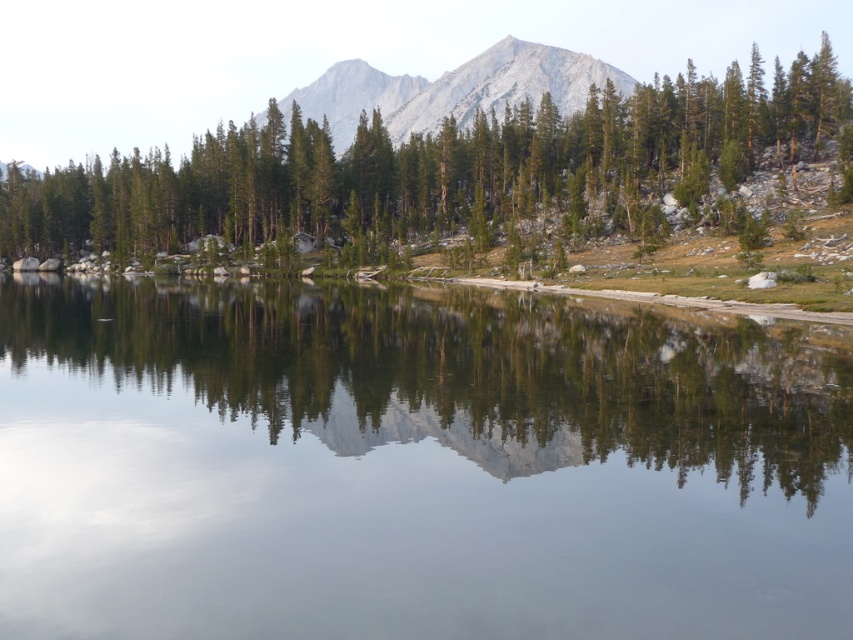
Question: Which object is the farthest from the smooth reflective water at center?

Choices:
 (A) gray rocky mountain at center
 (B) green matte tree at center

Answer: (A)

Question: Which point is closer to the camera taking this photo?

Choices:
 (A) (631, 614)
 (B) (279, 209)

Answer: (A)

Question: Does smooth reflective water at center come in front of gray rocky mountain at center?

Choices:
 (A) no
 (B) yes

Answer: (B)

Question: Does smooth reflective water at center lie behind gray rocky mountain at center?

Choices:
 (A) no
 (B) yes

Answer: (A)

Question: Which point is farther to the camera?

Choices:
 (A) green matte tree at center
 (B) smooth reflective water at center
 (C) gray rocky mountain at center

Answer: (C)

Question: Does smooth reflective water at center lie in front of gray rocky mountain at center?

Choices:
 (A) yes
 (B) no

Answer: (A)